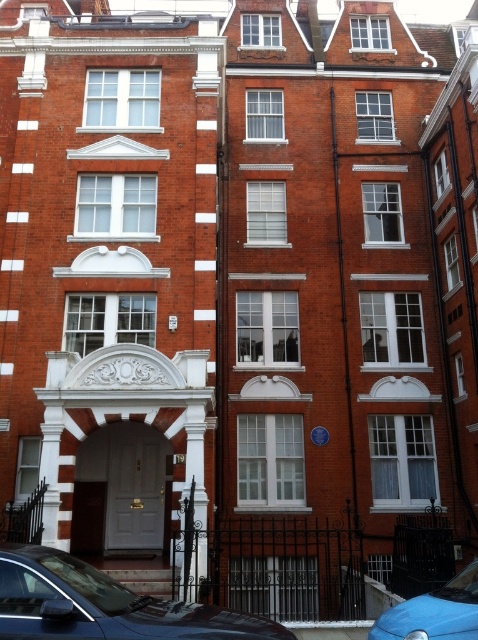
Question: Observing the image, what is the correct spatial positioning of shiny black car at lower left in reference to blue matte car at lower right?

Choices:
 (A) above
 (B) below

Answer: (A)

Question: Does shiny black car at lower left lie in front of blue matte car at lower right?

Choices:
 (A) yes
 (B) no

Answer: (A)

Question: Which of the following is the farthest from the observer?

Choices:
 (A) (454, 612)
 (B) (97, 570)

Answer: (B)

Question: Can you confirm if shiny black car at lower left is wider than blue matte car at lower right?

Choices:
 (A) no
 (B) yes

Answer: (A)

Question: Which point is closer to the camera taking this photo?

Choices:
 (A) (469, 612)
 (B) (213, 634)

Answer: (B)